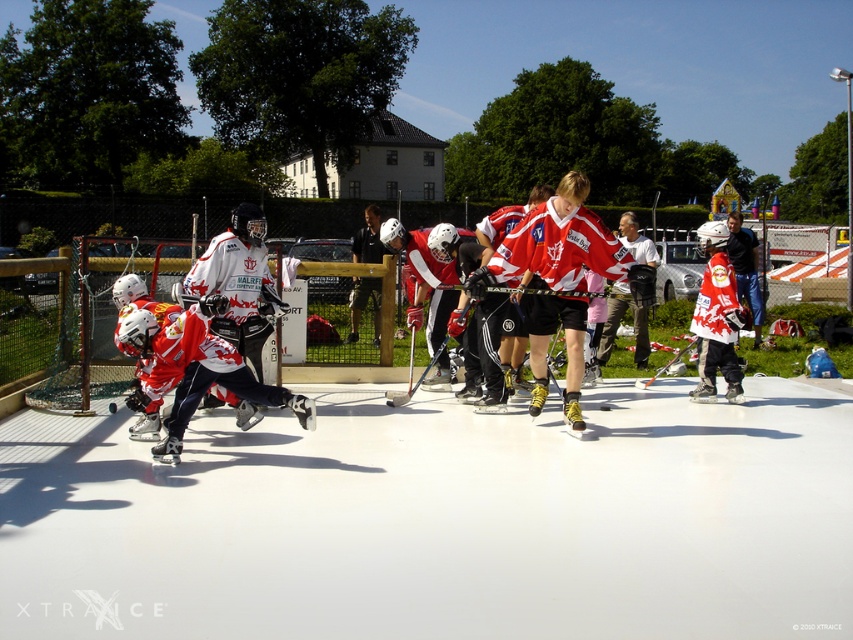
Who is more forward, [379,314] or [421,376]?

Point [421,376] is in front.

Which is below, black leather jacket at center or black glossy hockey stick at center?

black glossy hockey stick at center is lower down.

Is point (357, 310) closer to camera compared to point (404, 397)?

No, it is behind (404, 397).

Identify the location of black leather jacket at center. This screenshot has width=853, height=640. (364, 307).

Is black leather jacket at center shorter than white jersey at center?

In fact, black leather jacket at center may be taller than white jersey at center.

What are the coordinates of `black leather jacket at center` in the screenshot? It's located at (364, 307).

Between white jersey at center and black glossy hockey stick at center, which one is positioned lower?

black glossy hockey stick at center is lower down.

Can you confirm if white jersey at center is bigger than black glossy hockey stick at center?

Indeed, white jersey at center has a larger size compared to black glossy hockey stick at center.

Find the location of a particular element. This screenshot has width=853, height=640. white jersey at center is located at coordinates (746, 269).